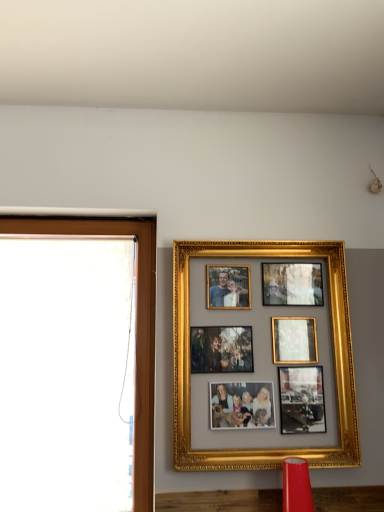
Question: Should I look upward or downward to see matte red lampshade at lower center?

Choices:
 (A) up
 (B) down

Answer: (B)

Question: Considering the relative sizes of gold/gilded photo frame at upper center and matte red lampshade at lower center in the image provided, is gold/gilded photo frame at upper center smaller than matte red lampshade at lower center?

Choices:
 (A) yes
 (B) no

Answer: (B)

Question: Is gold/gilded photo frame at upper center thinner than matte red lampshade at lower center?

Choices:
 (A) yes
 (B) no

Answer: (A)

Question: Does gold/gilded photo frame at upper center lie behind matte red lampshade at lower center?

Choices:
 (A) yes
 (B) no

Answer: (A)

Question: Does gold/gilded photo frame at upper center appear on the right side of matte red lampshade at lower center?

Choices:
 (A) yes
 (B) no

Answer: (B)

Question: From a real-world perspective, does gold/gilded photo frame at upper center sit lower than matte red lampshade at lower center?

Choices:
 (A) no
 (B) yes

Answer: (A)

Question: Is gold/gilded photo frame at upper center completely or partially outside of matte red lampshade at lower center?

Choices:
 (A) yes
 (B) no

Answer: (A)

Question: Is brown wooden window frame at left aimed at matte red lampshade at lower center?

Choices:
 (A) yes
 (B) no

Answer: (B)

Question: Is brown wooden window frame at left positioned beyond the bounds of matte red lampshade at lower center?

Choices:
 (A) no
 (B) yes

Answer: (B)

Question: Is brown wooden window frame at left not near matte red lampshade at lower center?

Choices:
 (A) yes
 (B) no

Answer: (B)

Question: Is brown wooden window frame at left taller than matte red lampshade at lower center?

Choices:
 (A) yes
 (B) no

Answer: (A)

Question: Does brown wooden window frame at left have a larger size compared to matte red lampshade at lower center?

Choices:
 (A) no
 (B) yes

Answer: (B)

Question: From a real-world perspective, is brown wooden window frame at left physically below matte red lampshade at lower center?

Choices:
 (A) no
 (B) yes

Answer: (A)

Question: From a real-world perspective, is matte red lampshade at lower center physically above brown wooden window frame at left?

Choices:
 (A) no
 (B) yes

Answer: (A)